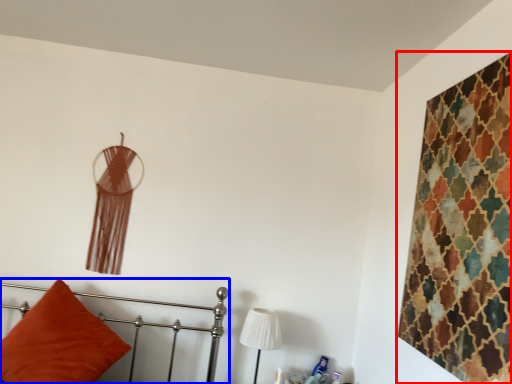
Question: Among these objects, which one is farthest to the camera, textile (highlighted by a red box) or furniture (highlighted by a blue box)?

Choices:
 (A) textile
 (B) furniture

Answer: (B)